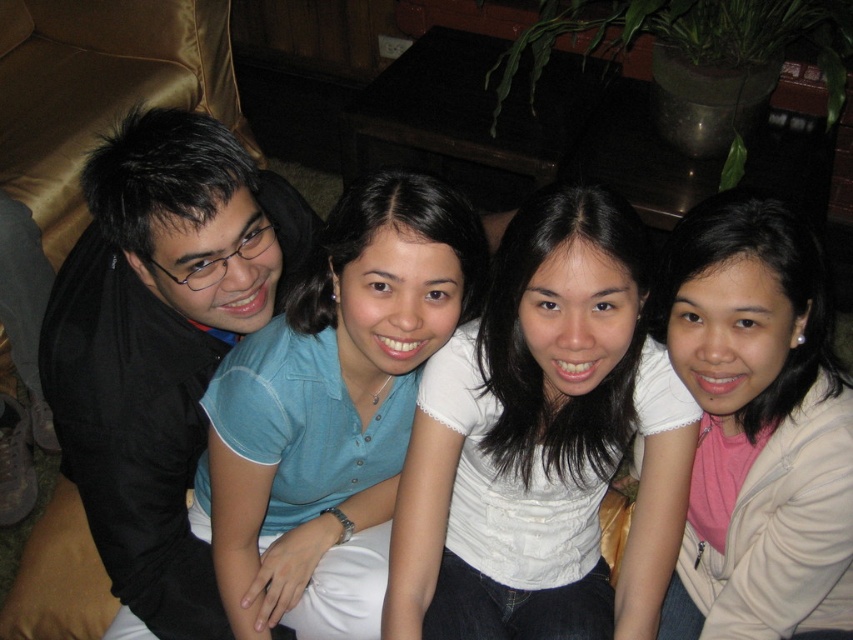
Question: Is white textured shirt at center positioned in front of black matte jacket at left?

Choices:
 (A) no
 (B) yes

Answer: (B)

Question: Which point is closer to the camera?

Choices:
 (A) (149, 445)
 (B) (502, 371)
 (C) (722, 336)
 (D) (396, 461)

Answer: (C)

Question: In this image, where is white textured shirt at center located relative to black matte jacket at left?

Choices:
 (A) right
 (B) left

Answer: (A)

Question: Can you confirm if black matte jacket at left is wider than beige fleece jacket at lower right?

Choices:
 (A) yes
 (B) no

Answer: (A)

Question: Which point appears farthest from the camera in this image?

Choices:
 (A) (610, 620)
 (B) (251, 284)

Answer: (A)

Question: Estimate the real-world distances between objects in this image. Which object is farther from the beige fleece jacket at lower right?

Choices:
 (A) white textured shirt at center
 (B) blue cotton shirt at center

Answer: (B)